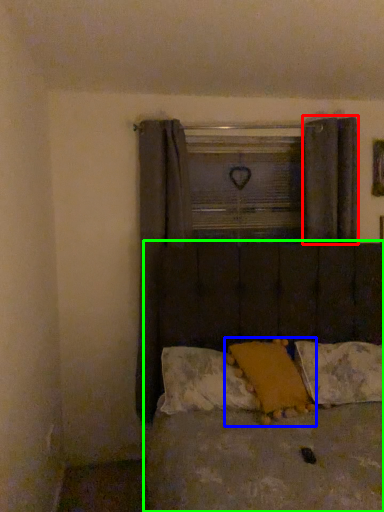
Question: Estimate the real-world distances between objects in this image. Which object is closer to curtain (highlighted by a red box), pillow (highlighted by a blue box) or bed (highlighted by a green box)?

Choices:
 (A) pillow
 (B) bed

Answer: (B)